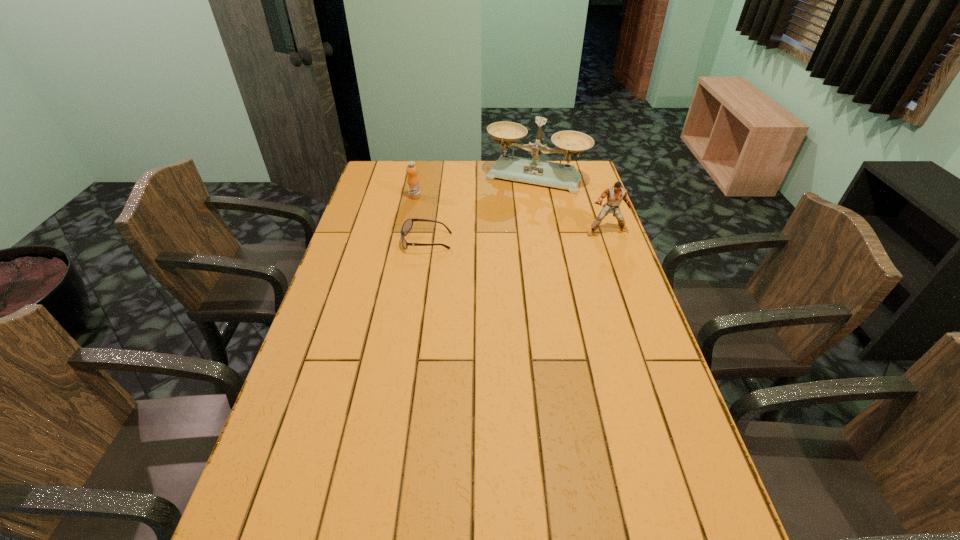
This screenshot has height=540, width=960. What are the coordinates of `blank area at the right edge` in the screenshot? It's located at coord(692,450).

What are the coordinates of `vacant space at the far left corner` in the screenshot? It's located at (392, 163).

Identify the location of blank region between the third tallest object and the scale. The image size is (960, 540). (475, 187).

Locate an element on the screen. This screenshot has height=540, width=960. empty space between the shortest object and the puncher is located at coordinates (516, 236).

Locate an element on the screen. This screenshot has width=960, height=540. free space between the scale and the shortest object is located at coordinates (481, 210).

Image resolution: width=960 pixels, height=540 pixels. Find the location of `vacant region between the scale and the third tallest object`. vacant region between the scale and the third tallest object is located at coordinates (475, 187).

This screenshot has height=540, width=960. I want to click on free space between the tallest object and the shortest object, so click(481, 210).

Find the location of a particular element. The image size is (960, 540). unoccupied position between the scale and the sunglasses is located at coordinates (481, 210).

Image resolution: width=960 pixels, height=540 pixels. I want to click on free space between the puncher and the second shortest object, so click(511, 214).

Image resolution: width=960 pixels, height=540 pixels. I want to click on vacant area between the puncher and the shortest object, so click(516, 236).